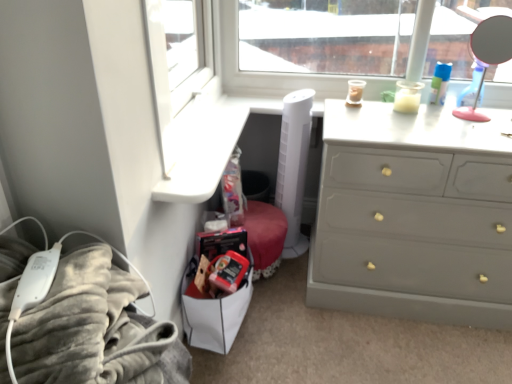
Question: Does polished silver mirror at upper right appear on the left side of velvety gray blanket at lower left?

Choices:
 (A) yes
 (B) no

Answer: (B)

Question: Is polished silver mirror at upper right next to velvety gray blanket at lower left?

Choices:
 (A) no
 (B) yes

Answer: (A)

Question: From the image's perspective, is polished silver mirror at upper right below velvety gray blanket at lower left?

Choices:
 (A) yes
 (B) no

Answer: (B)

Question: From the image's perspective, is polished silver mirror at upper right over velvety gray blanket at lower left?

Choices:
 (A) yes
 (B) no

Answer: (A)

Question: Is polished silver mirror at upper right facing towards velvety gray blanket at lower left?

Choices:
 (A) no
 (B) yes

Answer: (A)

Question: Does point (315, 241) appear closer or farther from the camera than point (488, 44)?

Choices:
 (A) farther
 (B) closer

Answer: (B)

Question: Would you say matte gray dresser at right is inside or outside polished silver mirror at upper right?

Choices:
 (A) inside
 (B) outside

Answer: (B)

Question: In terms of width, does matte gray dresser at right look wider or thinner when compared to polished silver mirror at upper right?

Choices:
 (A) wide
 (B) thin

Answer: (A)

Question: From the image's perspective, is matte gray dresser at right above or below polished silver mirror at upper right?

Choices:
 (A) below
 (B) above

Answer: (A)

Question: Is point (442, 132) closer or farther from the camera than point (106, 319)?

Choices:
 (A) closer
 (B) farther

Answer: (B)

Question: Based on their positions, is matte gray dresser at right located to the left or right of velvety gray blanket at lower left?

Choices:
 (A) left
 (B) right

Answer: (B)

Question: In terms of size, does matte gray dresser at right appear bigger or smaller than velvety gray blanket at lower left?

Choices:
 (A) small
 (B) big

Answer: (B)

Question: Is matte gray dresser at right wider or thinner than velvety gray blanket at lower left?

Choices:
 (A) wide
 (B) thin

Answer: (A)

Question: Which is correct: velvety gray blanket at lower left is inside matte gray dresser at right, or outside of it?

Choices:
 (A) outside
 (B) inside

Answer: (A)

Question: From a real-world perspective, is velvety gray blanket at lower left above or below matte gray dresser at right?

Choices:
 (A) above
 (B) below

Answer: (A)